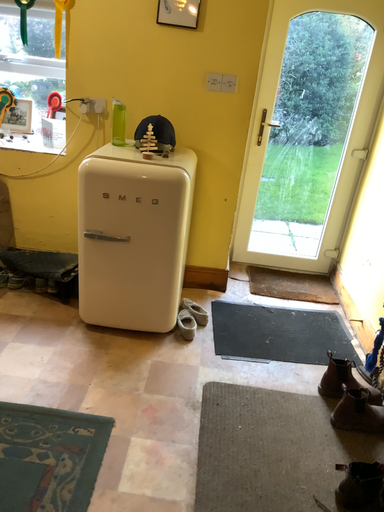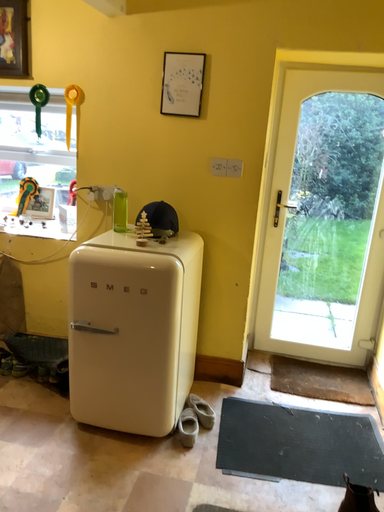
Question: Which way did the camera rotate in the video?

Choices:
 (A) rotated upward
 (B) rotated downward

Answer: (A)